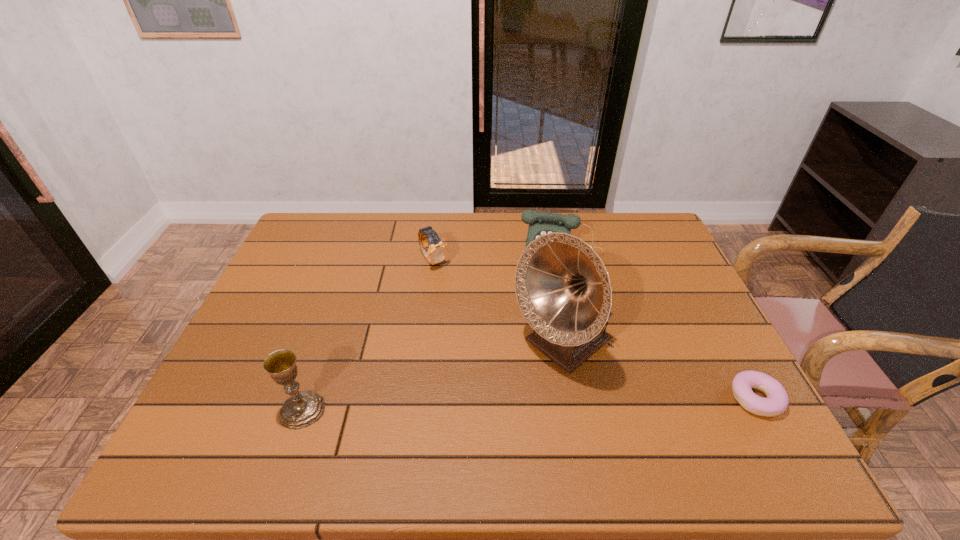
Image resolution: width=960 pixels, height=540 pixels. Identify the location of telephone at the far edge. (540, 223).

The height and width of the screenshot is (540, 960). I want to click on chalice at the near edge, so [303, 408].

I want to click on doughnut positioned at the near edge, so click(777, 400).

Find the location of a particular element. object situated at the right edge is located at coordinates (777, 400).

Where is `object that is at the near right corner`? object that is at the near right corner is located at coordinates (777, 400).

Identify the location of vacant region at the far edge of the desktop. (583, 231).

This screenshot has height=540, width=960. In order to click on vacant space at the near edge of the desktop in this screenshot , I will do `click(397, 409)`.

At what (x,y) coordinates should I click in order to perform the action: click on vacant space at the left edge. Please return your answer as a coordinate pair (x, y). This screenshot has height=540, width=960. Looking at the image, I should click on (265, 312).

You are a GUI agent. You are given a task and a screenshot of the screen. Output one action in this format:
    pyautogui.click(x=<x>, y=<y>)
    Task: Click on the free space at the right edge of the desktop
    This screenshot has width=960, height=540.
    Given the screenshot: What is the action you would take?
    pyautogui.click(x=665, y=281)

In the image, there is a desktop. At what (x,y) coordinates should I click in order to perform the action: click on free region at the far left corner. Please return your answer as a coordinate pair (x, y). The height and width of the screenshot is (540, 960). Looking at the image, I should click on (326, 254).